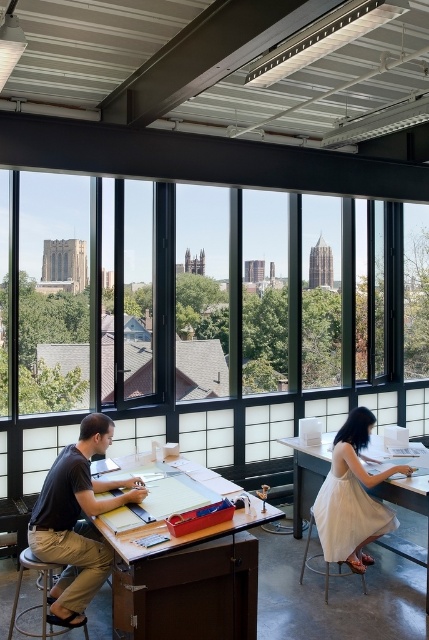
Does wooden drafting table at center lie in front of white cotton dress at center?

Yes.

Is point (254, 497) positioned behind point (350, 484)?

No.

Does point (132, 564) come closer to viewer compared to point (334, 561)?

Yes, point (132, 564) is in front of point (334, 561).

Image resolution: width=429 pixels, height=640 pixels. Identify the location of wooden drafting table at center. (187, 580).

Does white cotton dress at center appear over white fabric table at lower right?

Indeed, white cotton dress at center is positioned over white fabric table at lower right.

Locate an element on the screen. The image size is (429, 640). white cotton dress at center is located at coordinates [353, 497].

Where is `white cotton dress at center`? This screenshot has width=429, height=640. white cotton dress at center is located at coordinates (353, 497).

Who is more forward, (371, 451) or (308, 540)?

Point (308, 540)

Based on the photo, is the position of white fabric table at lower right more distant than that of white fabric stool at lower right?

Yes, white fabric table at lower right is behind white fabric stool at lower right.

Between point (398, 540) and point (311, 528), which one is positioned in front?

Point (311, 528) is in front.

Locate an element on the screen. The width and height of the screenshot is (429, 640). white fabric table at lower right is located at coordinates (305, 477).